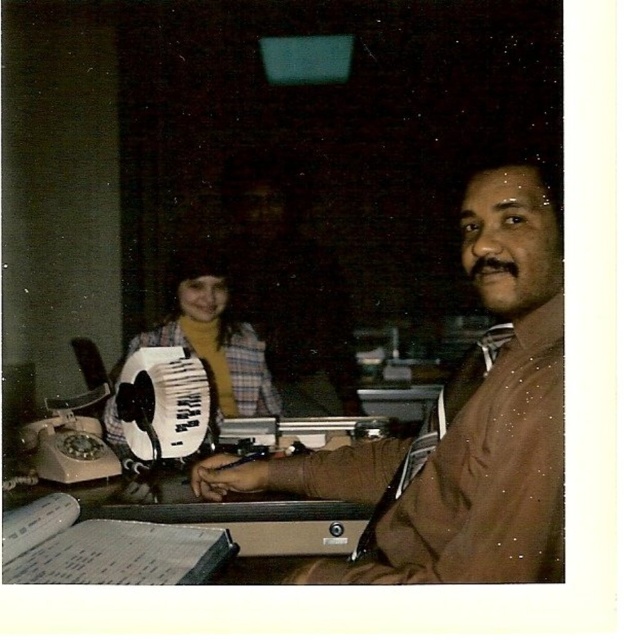
You are organizing items on a desk and need to place both the brown smooth shirt at right and the plaid fabric accordion at center. Given their sizes, which item should you place first to ensure they both fit?

The brown smooth shirt at right is larger in size than the plaid fabric accordion at center, so you should place the brown smooth shirt at right first to ensure there is enough space for both items.

In the scene shown: You are standing in front of the desk in the image. There are two points marked on the desk surface. One is at coordinates point (487, 333) and the other is at point (255, 380). Which point is closer to you?

Point (487, 333) is closer to the viewer than point (255, 380).

You are standing in the office and need to reach the rotary telephone on the desk. The brown smooth shirt at right is in your way. Can you move around it to get to the telephone?

The brown smooth shirt at right is located at point (461, 422), so you can move around it to reach the rotary telephone on the desk.